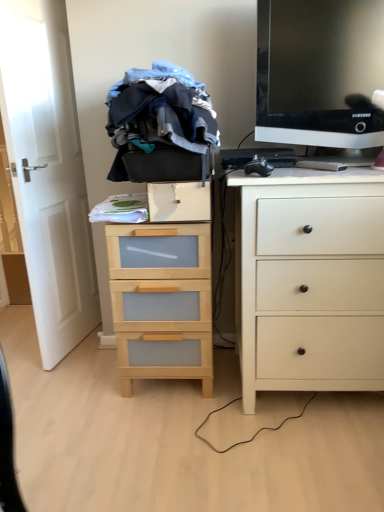
Where is `blank space above black plastic keyboard at center (from a real-world perspective)`? This screenshot has height=512, width=384. blank space above black plastic keyboard at center (from a real-world perspective) is located at coordinates (261, 148).